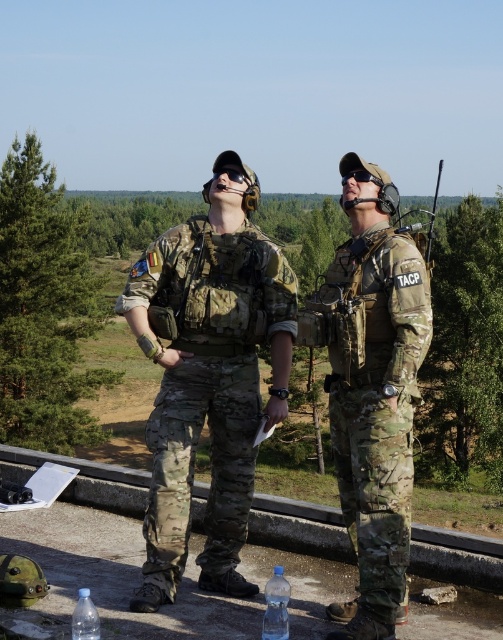
Who is more forward, (233, 152) or (407, 266)?

Point (407, 266) is in front.

Does camouflage uniform at center appear on the left side of camouflage fabric uniform at center?

Indeed, camouflage uniform at center is positioned on the left side of camouflage fabric uniform at center.

Between point (166, 230) and point (370, 323), which one is positioned behind?

Positioned behind is point (166, 230).

The image size is (503, 640). I want to click on camouflage uniform at center, so tap(209, 378).

Does camouflage uniform at center appear under black matte goggles at upper center?

Yes, camouflage uniform at center is below black matte goggles at upper center.

Between camouflage uniform at center and black matte goggles at upper center, which one has less height?

black matte goggles at upper center

Measure the distance between point (252, 490) and camera.

The distance of point (252, 490) from camera is 5.18 meters.

Where is `camouflage uniform at center`? The width and height of the screenshot is (503, 640). camouflage uniform at center is located at coordinates pyautogui.click(x=209, y=378).

In the scene shown: Is the position of camouflage fabric uniform at center more distant than that of clear plastic bottle at lower center?

That is True.

Between camouflage fabric uniform at center and clear plastic bottle at lower center, which one is positioned lower?

clear plastic bottle at lower center

This screenshot has width=503, height=640. Find the location of `camouflage fabric uniform at center`. camouflage fabric uniform at center is located at coordinates (376, 404).